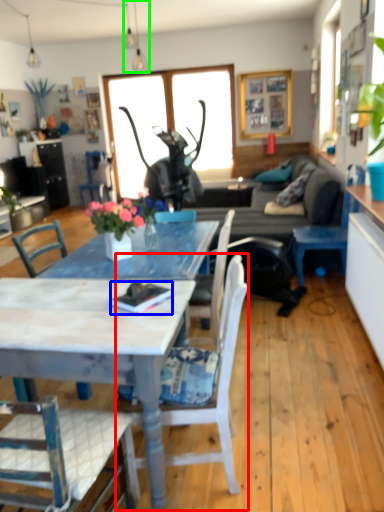
Question: Which is nearer to the chair (highlighted by a red box)? book (highlighted by a blue box) or lamp (highlighted by a green box).

Choices:
 (A) book
 (B) lamp

Answer: (A)